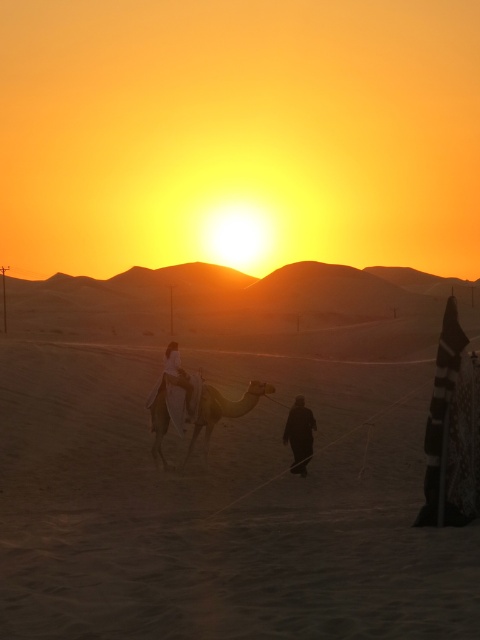
You are planning to set up a tent for a desert camping trip. You have a tent that requires a flat area twice as wide as the brown textured camel at center. Can the sandy beige sand at center provide enough space for your tent?

The sandy beige sand at center is wider than the brown textured camel at center. Since the required space is twice the camel width, but the sand area is only wider than the camel, it might not be sufficient. Check the exact measurements.

You are a photographer capturing the sunset scene. You notice the brown textured camel at center and the dark matte person at center. Which object is positioned higher in the image?

The brown textured camel at center is located above the dark matte person at center, so it is positioned higher in the image.